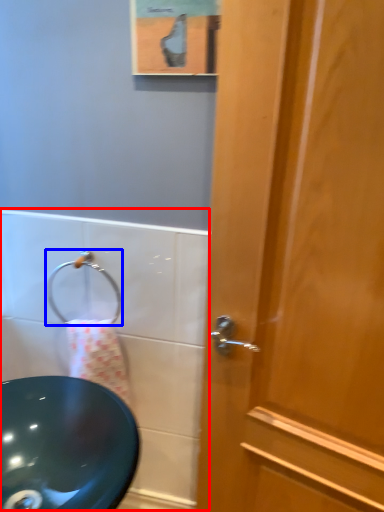
Question: Which object appears closest to the camera in this image, bath (highlighted by a red box) or shower (highlighted by a blue box)?

Choices:
 (A) bath
 (B) shower

Answer: (A)